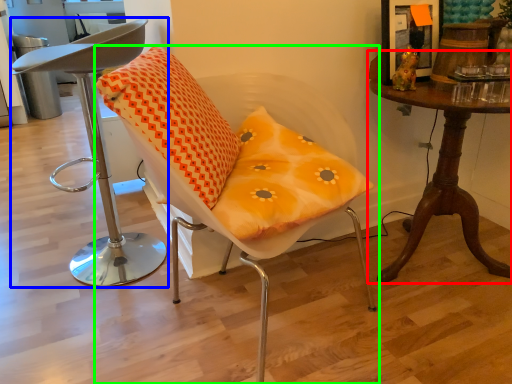
Question: Estimate the real-world distances between objects in this image. Which object is farther from table (highlighted by a red box), chair (highlighted by a blue box) or chair (highlighted by a green box)?

Choices:
 (A) chair
 (B) chair

Answer: (A)